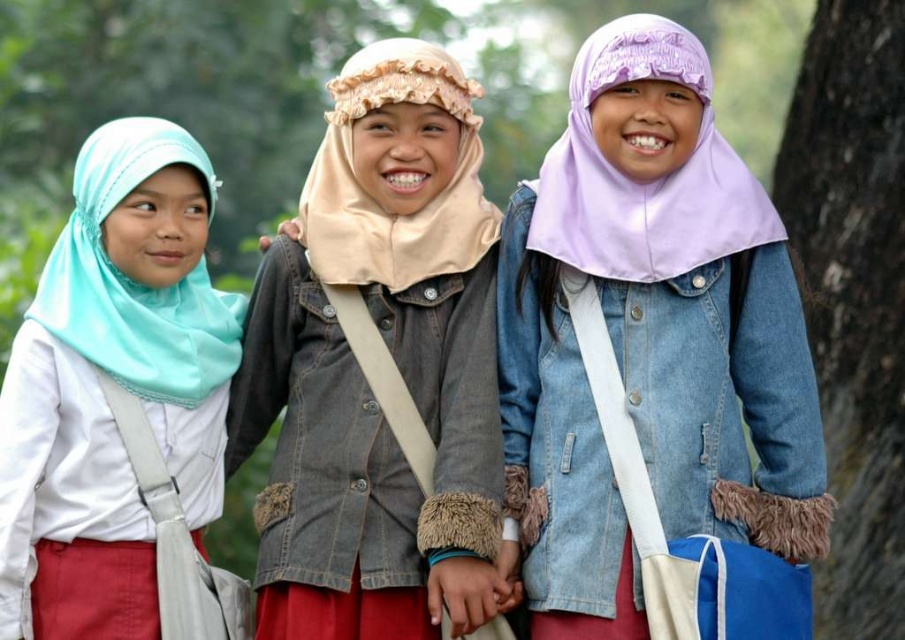
You are a photographer trying to capture a group photo of the three girls. Since the purple matte hijab at center and the denim jacket at center are both in the frame, which one would you focus on to ensure they are both clearly visible?

The purple matte hijab at center has a larger width than the denim jacket at center, so focusing on the purple matte hijab at center would ensure both are clearly visible as it occupies more space in the frame.

Please look at the image. There are three girls standing outside. The middle girl is wearing a denim jacket with fur lined cuffs. The girl on the left has a light teal hijab and red pants. The third girl is on the right. Where exactly is the denim jacket at center located in the image? Please provide the coordinates in the format of point followed by numbers like point (379, 369).

The denim jacket at center is located at point (379, 369).

Based on the scene, can you determine if the matte light blue hijab at left is located below the smooth bark tree at right?

Yes, the matte light blue hijab at left is positioned under the smooth bark tree at right according to the description.